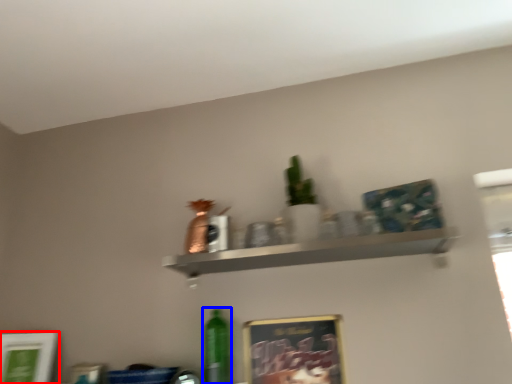
Question: Among these objects, which one is farthest to the camera, picture frame (highlighted by a red box) or bottle (highlighted by a blue box)?

Choices:
 (A) picture frame
 (B) bottle

Answer: (B)